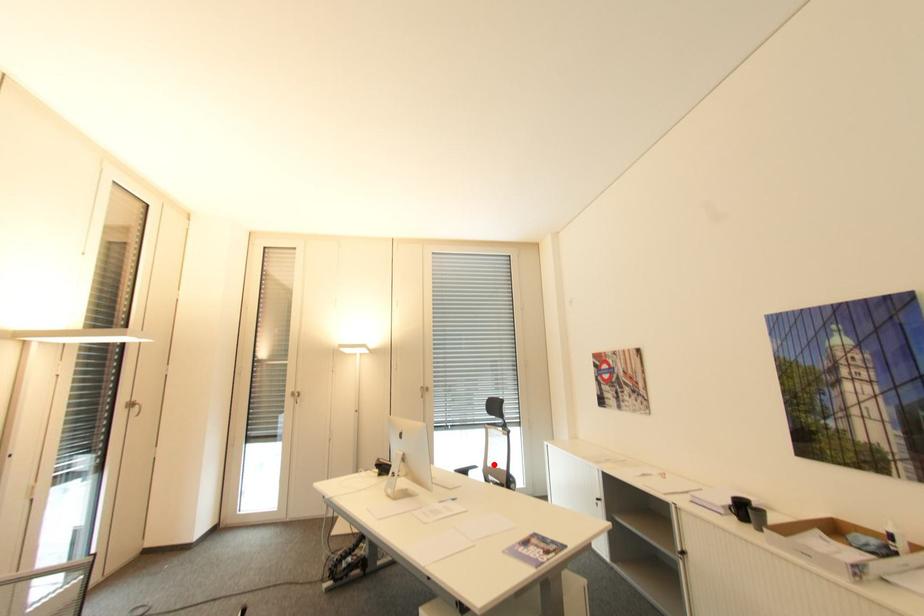
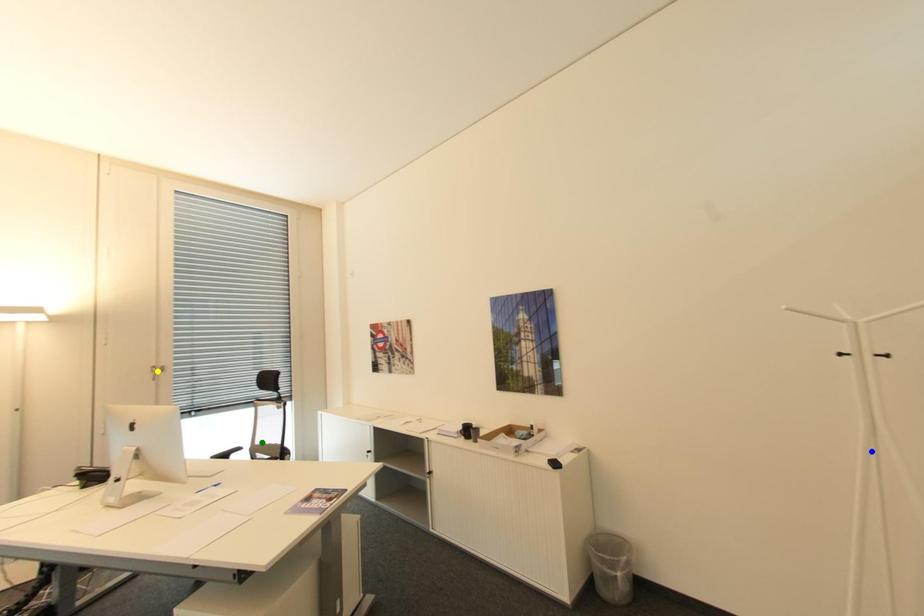
Question: I am providing you with two images of the same scene from different viewpoints. A red point is marked on the first image. You are given multiple points on the second image. Which mark in image 2 goes with the point in image 1?

Choices:
 (A) yellow point
 (B) blue point
 (C) green point

Answer: (C)